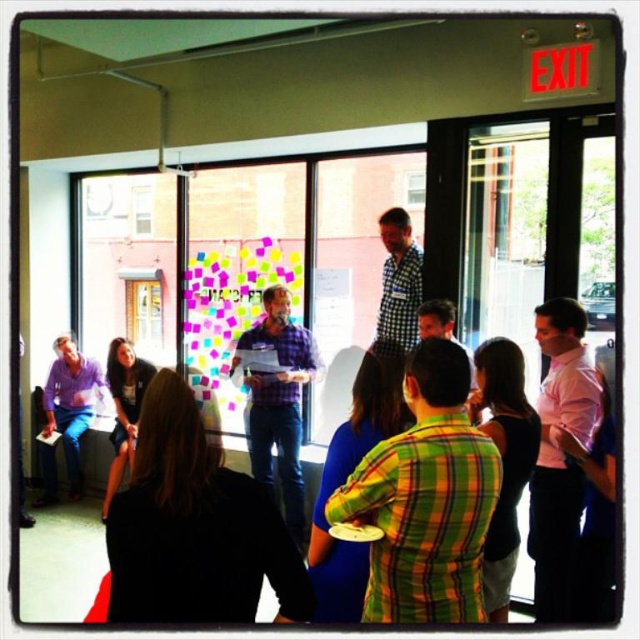
Question: Can you confirm if green plaid shirt at center is positioned below pink shirt at right?

Choices:
 (A) no
 (B) yes

Answer: (A)

Question: Which of the following is the farthest from the observer?

Choices:
 (A) (292, 509)
 (B) (388, 216)

Answer: (A)

Question: Can you confirm if green plaid shirt at center is positioned to the right of pink shirt at right?

Choices:
 (A) no
 (B) yes

Answer: (A)

Question: Which object is the farthest from the checkered fabric shirt at center?

Choices:
 (A) pink shirt at right
 (B) green plaid shirt at center

Answer: (B)

Question: Considering the real-world distances, which object is closest to the plaid shirt at center?

Choices:
 (A) checkered fabric shirt at center
 (B) pink shirt at right
 (C) green plaid shirt at center

Answer: (A)

Question: Does plaid shirt at center have a larger size compared to checkered fabric shirt at center?

Choices:
 (A) yes
 (B) no

Answer: (A)